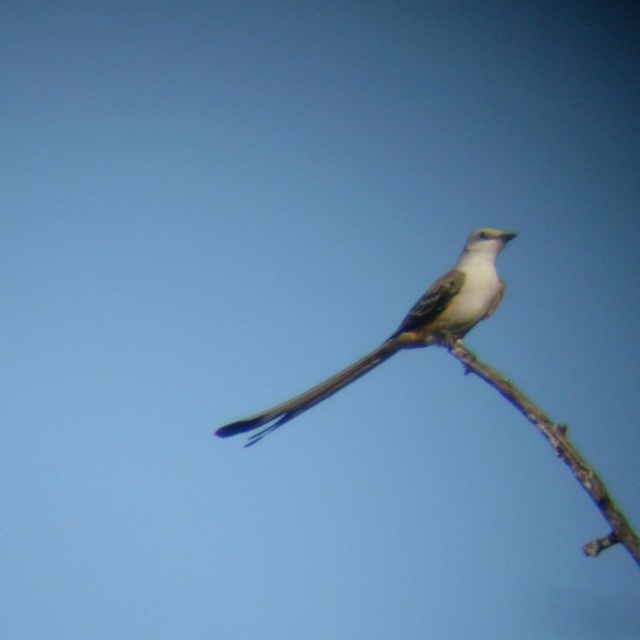
You are an ornithologist observing a bird with a silvery metallic tail at center perched on a brown rough tree branch at right. From your observation point, which object is closer to you?

The brown rough tree branch at right is closer to you because it is in front of the silvery metallic tail at center.

A bird with a long forked tail is perched on a brown rough tree branch at right. The bird wants to fly to a tree 5 meters away. Can it reach the tree without flapping its wings?

The distance between the bird and the tree is 5.07 meters. Since the bird needs to flap its wings to cover that distance, it cannot reach the tree without flapping its wings.